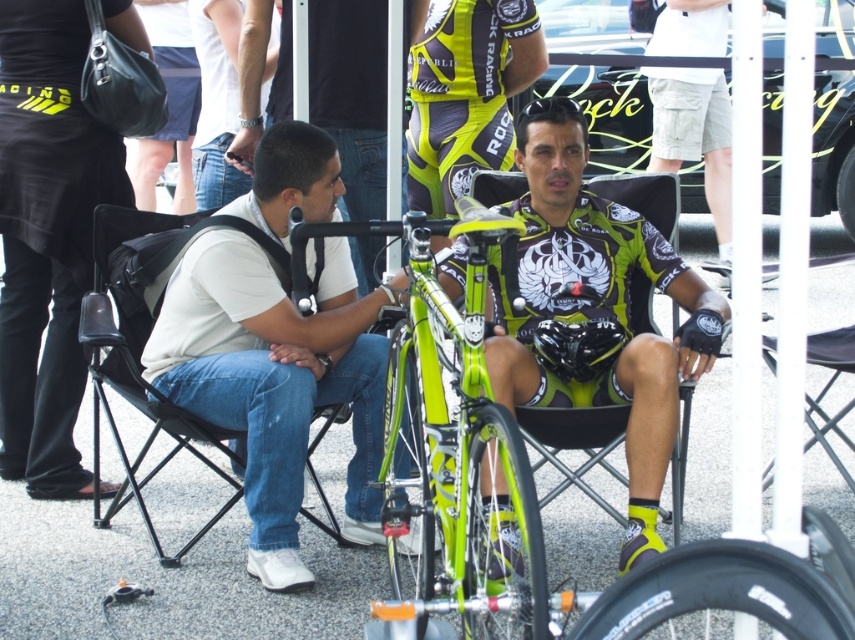
How far apart are white cotton shirt at left and green matte cycling jersey at center?

white cotton shirt at left and green matte cycling jersey at center are 33.86 inches apart.

Based on the photo, does white cotton shirt at left have a larger size compared to green matte cycling jersey at center?

Actually, white cotton shirt at left might be smaller than green matte cycling jersey at center.

What do you see at coordinates (275, 380) in the screenshot?
I see `white cotton shirt at left` at bounding box center [275, 380].

Locate an element on the screen. The width and height of the screenshot is (855, 640). white cotton shirt at left is located at coordinates (275, 380).

Who is more forward, [644,516] or [736,264]?

Point [736,264] is in front.

Who is more forward, (582, 310) or (740, 339)?

Point (740, 339)

Find the location of `green matte cycling jersey at center`. green matte cycling jersey at center is located at coordinates (594, 310).

This screenshot has width=855, height=640. I want to click on green glossy bicycle at center, so click(451, 442).

How much distance is there between green glossy bicycle at center and white metallic pole at right?

They are 37.52 inches apart.

Is point (447, 580) closer to camera compared to point (733, 97)?

No.

I want to click on green glossy bicycle at center, so click(x=451, y=442).